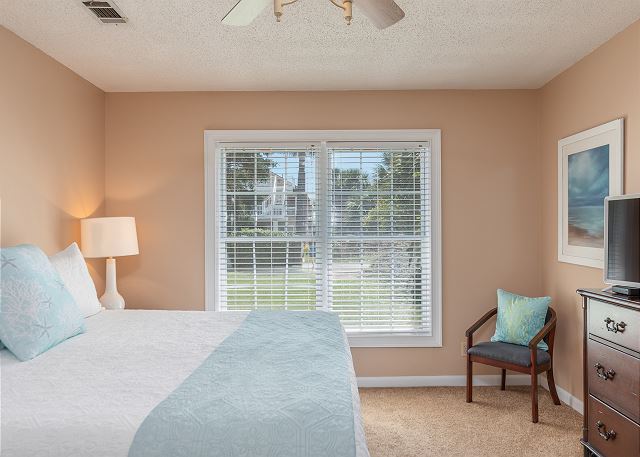
I want to click on window, so click(284, 190), click(262, 271), click(365, 294), click(374, 196).